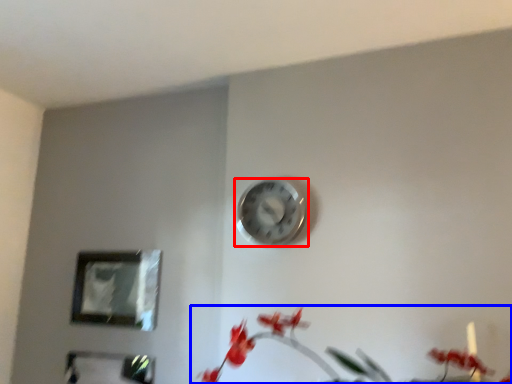
Question: Among these objects, which one is farthest to the camera, wall clock (highlighted by a red box) or floral arrangement (highlighted by a blue box)?

Choices:
 (A) wall clock
 (B) floral arrangement

Answer: (A)